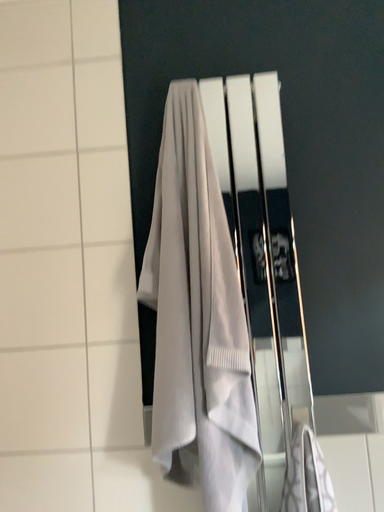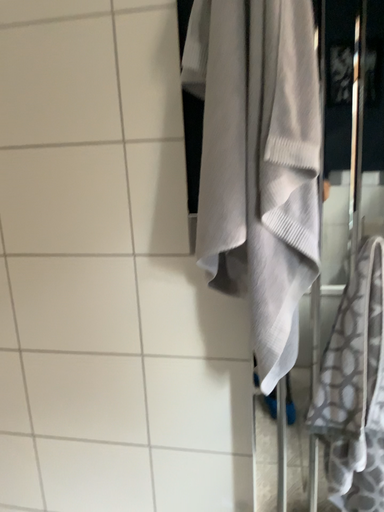
Question: How did the camera likely rotate when shooting the video?

Choices:
 (A) rotated left
 (B) rotated right

Answer: (A)